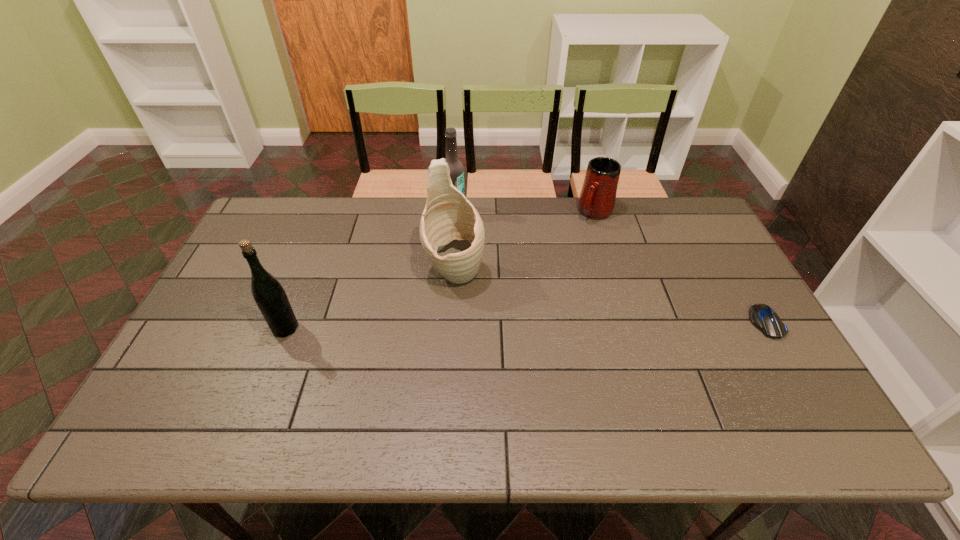
At what (x,y) coordinates should I click in order to perform the action: click on free spot that satisfies the following two spatial constraints: 1. on the back side of the second object from right to left; 2. on the right side of the nearer beer bottle. Please return your answer as a coordinate pair (x, y). Image resolution: width=960 pixels, height=540 pixels. Looking at the image, I should click on (331, 213).